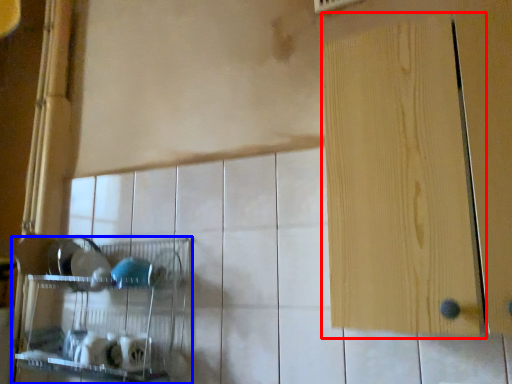
Question: Which object appears closest to the camera in this image, door (highlighted by a red box) or shelf (highlighted by a blue box)?

Choices:
 (A) door
 (B) shelf

Answer: (A)